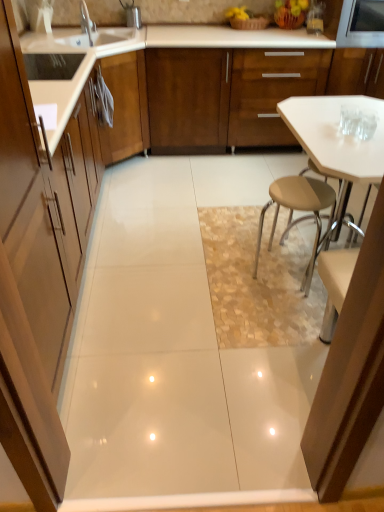
The width and height of the screenshot is (384, 512). Find the location of `free spot above white glossy table at center (from a real-world perspective)`. free spot above white glossy table at center (from a real-world perspective) is located at coordinates pyautogui.click(x=336, y=121).